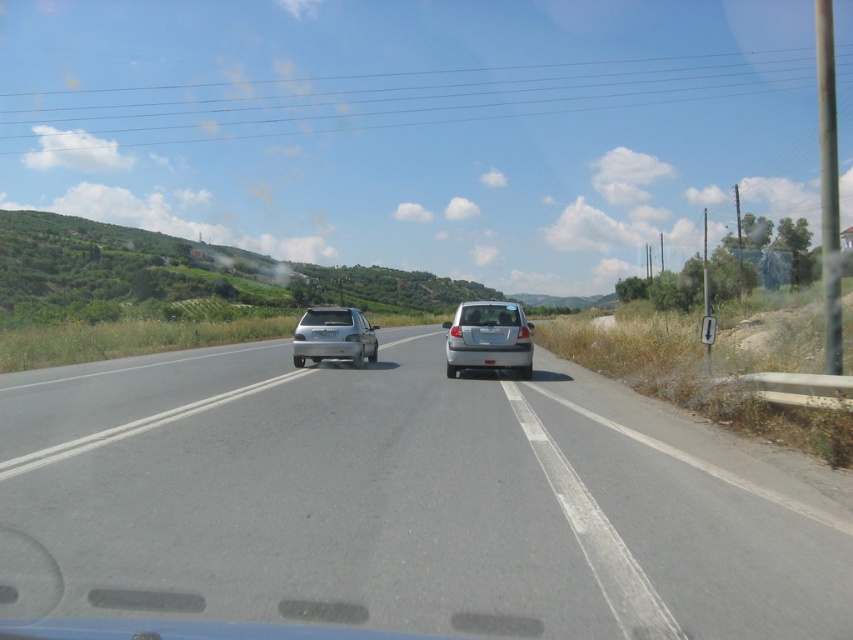
Question: Does gray asphalt road at center appear over white plastic license plate at center?

Choices:
 (A) no
 (B) yes

Answer: (A)

Question: Among these points, which one is nearest to the camera?

Choices:
 (A) (415, 490)
 (B) (326, 352)
 (C) (318, 336)
 (D) (517, 349)

Answer: (A)

Question: In this image, where is gray asphalt road at center located relative to white plastic license plate at center?

Choices:
 (A) above
 (B) below

Answer: (B)

Question: Which point appears farthest from the camera in this image?

Choices:
 (A) coord(456,342)
 (B) coord(316,333)

Answer: (B)

Question: Which point is farther to the camera?

Choices:
 (A) gray asphalt road at center
 (B) silver metallic car at center
 (C) white plastic license plate at center

Answer: (C)

Question: Does gray asphalt road at center lie in front of silver metallic car at center?

Choices:
 (A) yes
 (B) no

Answer: (A)